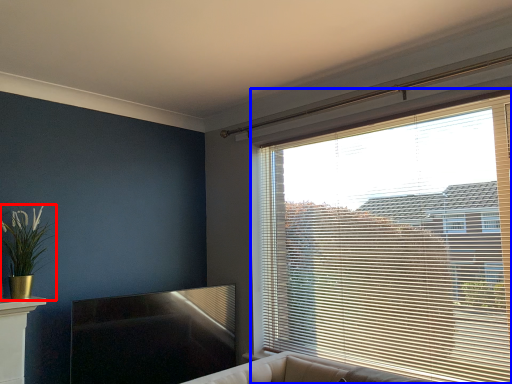
Question: Among these objects, which one is farthest to the camera, houseplant (highlighted by a red box) or window blind (highlighted by a blue box)?

Choices:
 (A) houseplant
 (B) window blind

Answer: (A)